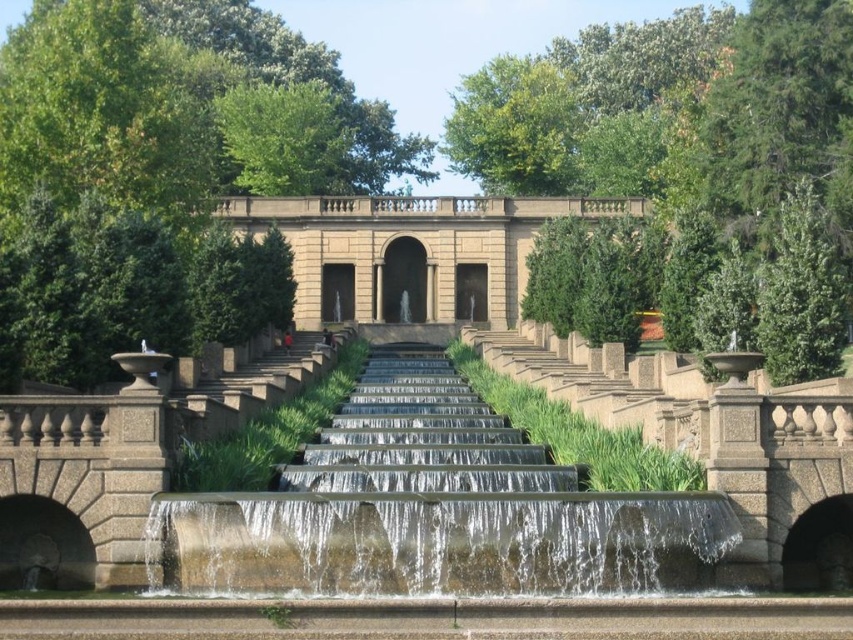
Does beige stone palace at center appear on the right side of smooth stone stairs at center?

Correct, you'll find beige stone palace at center to the right of smooth stone stairs at center.

Can you confirm if beige stone palace at center is wider than smooth stone stairs at center?

Correct, the width of beige stone palace at center exceeds that of smooth stone stairs at center.

Is point (531, 198) positioned in front of point (349, 330)?

No, (531, 198) is behind (349, 330).

Find the location of a particular element. Image resolution: width=853 pixels, height=640 pixels. beige stone palace at center is located at coordinates (410, 250).

Is point (451, 566) in front of point (518, 234)?

Yes, it is.

What do you see at coordinates (434, 512) in the screenshot? Image resolution: width=853 pixels, height=640 pixels. I see `smooth concrete fountain at center` at bounding box center [434, 512].

Does point (366, 490) come behind point (489, 243)?

That is False.

Image resolution: width=853 pixels, height=640 pixels. I want to click on smooth concrete fountain at center, so click(434, 512).

Who is higher up, smooth concrete fountain at center or smooth stone stairs at center?

smooth stone stairs at center is above.

In the scene shown: Can you confirm if smooth concrete fountain at center is thinner than smooth stone stairs at center?

In fact, smooth concrete fountain at center might be wider than smooth stone stairs at center.

Where is `smooth concrete fountain at center`? Image resolution: width=853 pixels, height=640 pixels. smooth concrete fountain at center is located at coordinates (434, 512).